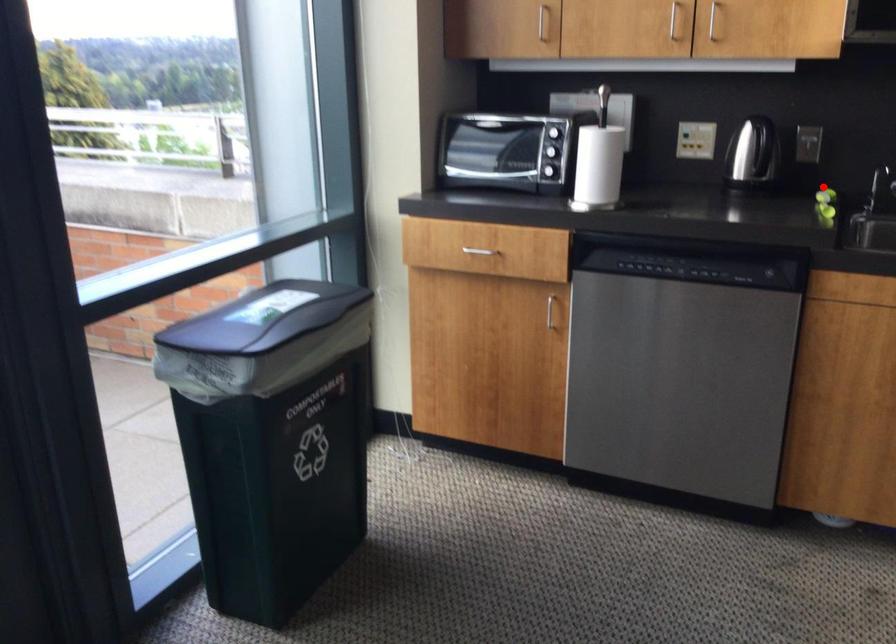
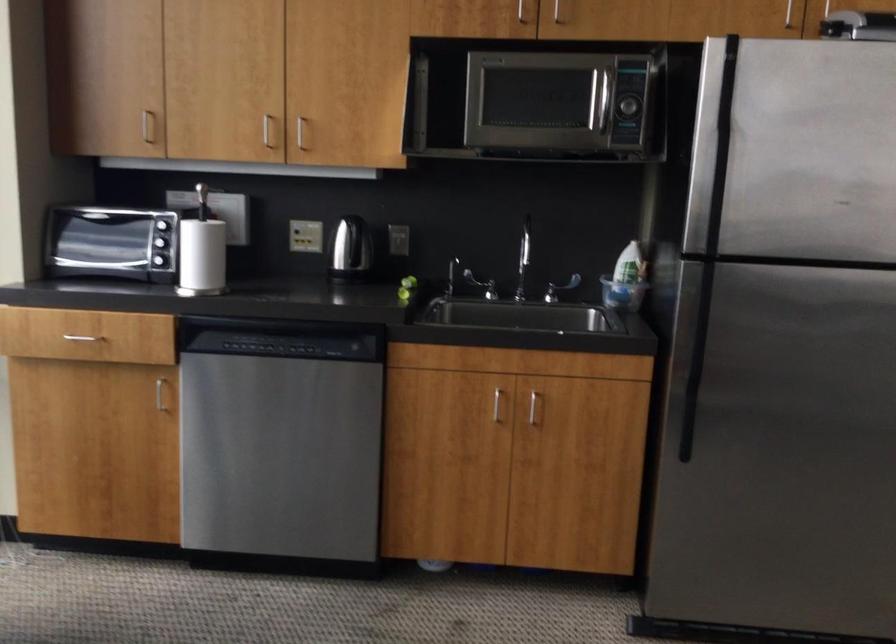
Find the pixel in the second image that matches the highlighted location in the first image.

(409, 281)